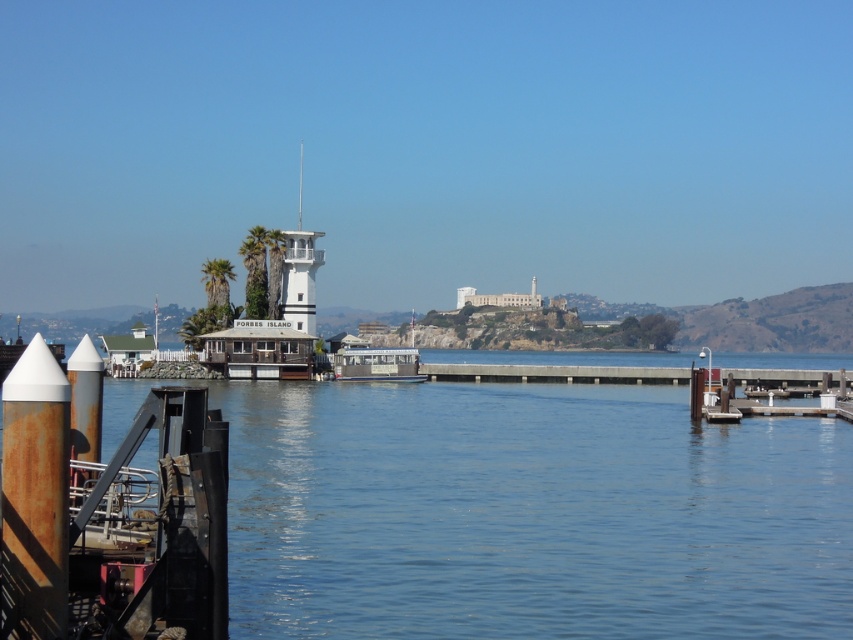
You are standing at the end of the dock and want to take a photo of the green leafy palm tree at center. If your camera has a maximum zoom range of 100 meters, will you be able to capture the palm tree clearly?

The green leafy palm tree at center is 98.20 meters away from the camera. Since the camera can zoom up to 100 meters, you can capture the palm tree clearly within the maximum zoom range.

You are a photographer planning to capture a sunset shot from the dock. You want to ensure the white painted wood tower at center and the green leafy palm tree at center are both visible in the frame. Given their heights, which object will appear taller in your photo?

The white painted wood tower at center will appear taller in the photo since it has a greater height compared to the green leafy palm tree at center.